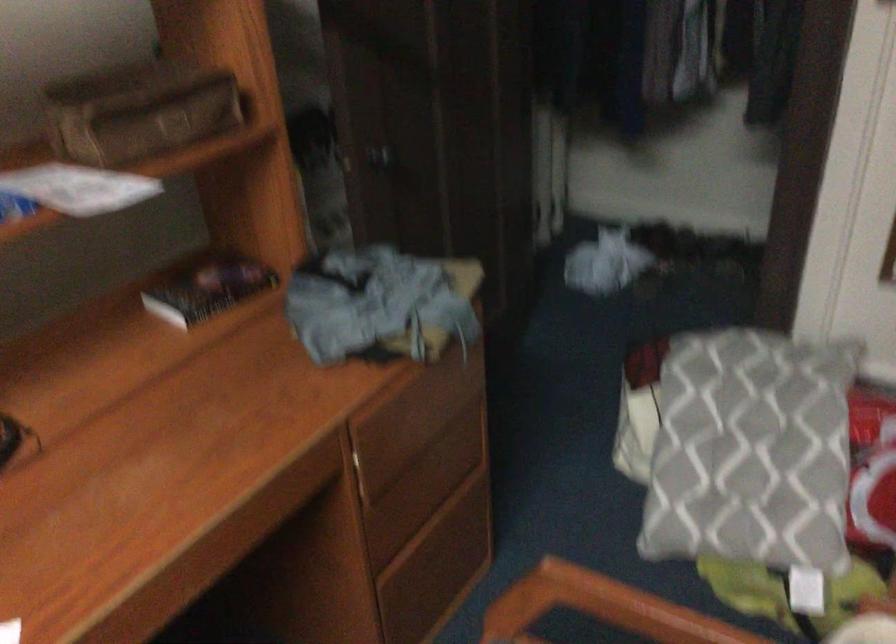
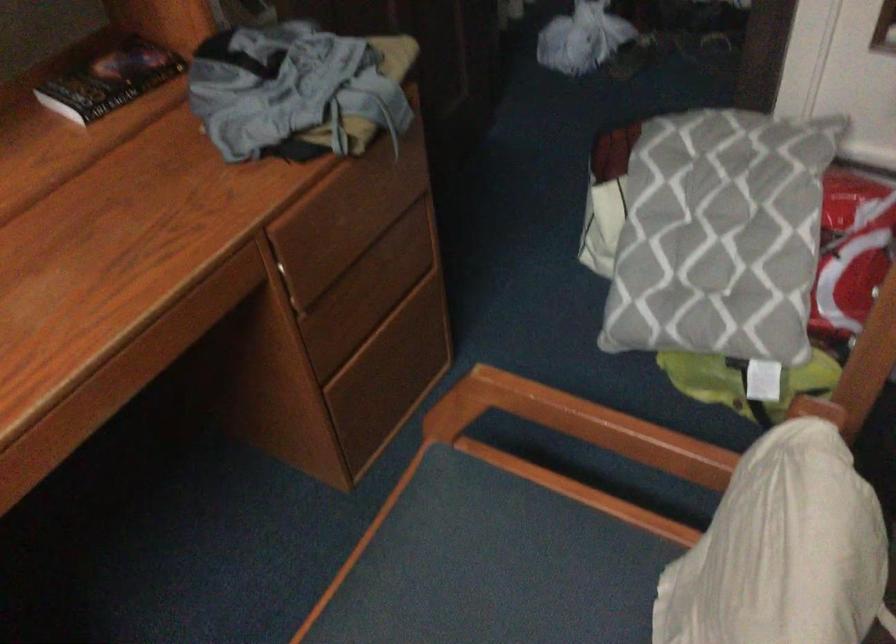
In the second image, find the point that corresponds to (754,447) in the first image.

(719, 236)